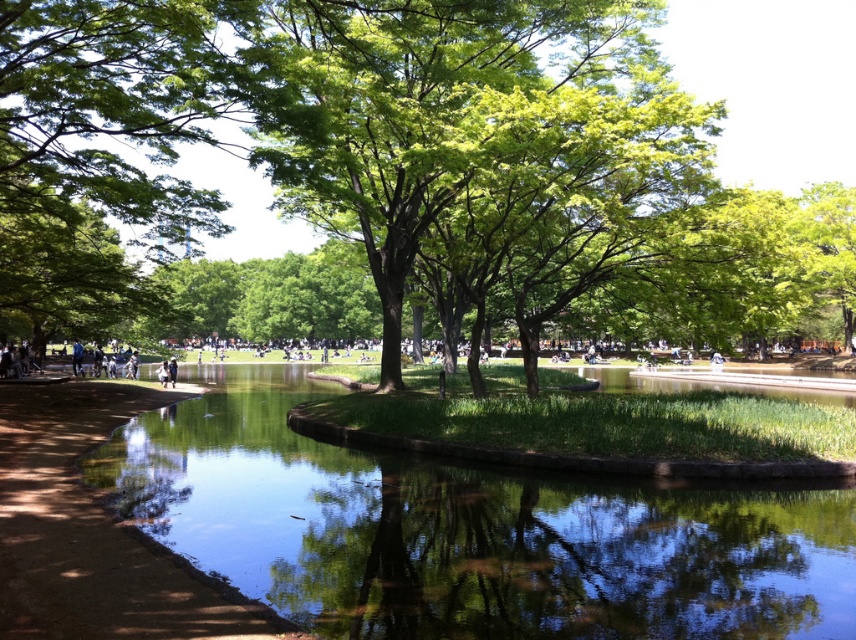
Can you confirm if green leafy tree at left is positioned to the right of dirt path at lower left?

Incorrect, green leafy tree at left is not on the right side of dirt path at lower left.

Is green leafy tree at left above dirt path at lower left?

Yes.

Who is more distant from viewer, (116, 209) or (165, 397)?

The point (165, 397) is behind.

Where is `green leafy tree at left`? This screenshot has width=856, height=640. green leafy tree at left is located at coordinates (100, 150).

Does clear water at center lie in front of green leafy tree at center?

That is True.

Is clear water at center smaller than green leafy tree at center?

Yes.

Which is in front, point (809, 627) or point (152, 140)?

Point (809, 627)

Locate an element on the screen. clear water at center is located at coordinates (468, 531).

Is green leafy tree at left taller than green leafy tree at center?

Incorrect, green leafy tree at left's height is not larger of green leafy tree at center's.

Does green leafy tree at left appear over green leafy tree at center?

No.

You are a GUI agent. You are given a task and a screenshot of the screen. Output one action in this format:
    pyautogui.click(x=<x>, y=<y>)
    Task: Click on the green leafy tree at left
    The height and width of the screenshot is (640, 856).
    Given the screenshot: What is the action you would take?
    pyautogui.click(x=100, y=150)